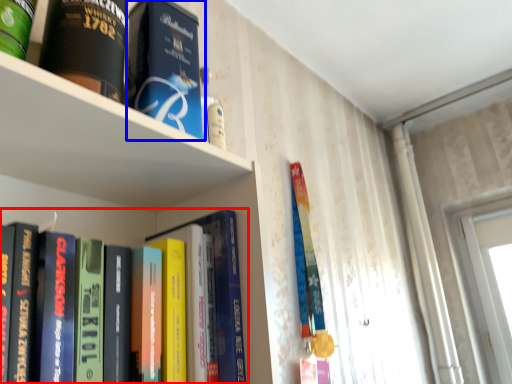
Question: Which object appears closest to the camera in this image, book (highlighted by a red box) or book (highlighted by a blue box)?

Choices:
 (A) book
 (B) book

Answer: (A)